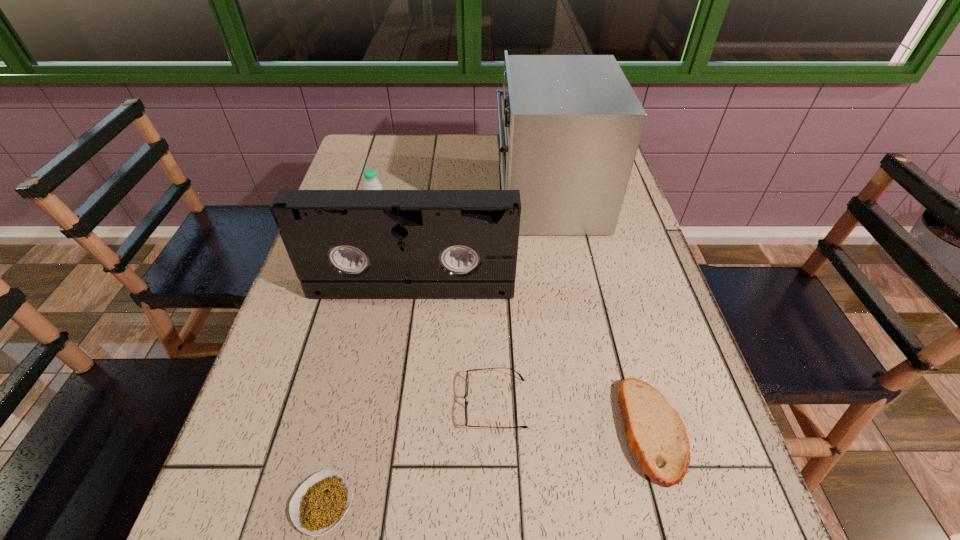
Find the location of `vacant region located 0.340m on the side of the fourth nearest object with visible spindles`. vacant region located 0.340m on the side of the fourth nearest object with visible spindles is located at coordinates (390, 443).

Identify the location of vacant region located on the right of the water bottle. (480, 223).

Identify the location of vacant space located 0.070m on the front of the pita bread. This screenshot has height=540, width=960. (683, 535).

You are a GUI agent. You are given a task and a screenshot of the screen. Output one action in this format:
    pyautogui.click(x=<x>, y=<y>)
    Task: Click on the free spot located 0.100m on the front-facing side of the second shortest object
    The image size is (960, 540).
    Given the screenshot: What is the action you would take?
    pyautogui.click(x=412, y=403)

Identify the location of free location located 0.330m on the front-facing side of the second shortest object. This screenshot has width=960, height=540. (291, 403).

Identify the location of blank space located 0.130m on the front-facing side of the second shortest object. This screenshot has height=540, width=960. (396, 403).

Identify the location of free region located on the back of the legume. The image size is (960, 540). (367, 313).

This screenshot has width=960, height=540. I want to click on object that is positioned at the far edge, so click(x=570, y=125).

You are a GUI agent. You are given a task and a screenshot of the screen. Output one action in this format:
    pyautogui.click(x=<x>, y=<y>)
    Task: Click on the object that is positioned at the near edge
    This screenshot has width=960, height=540.
    Given the screenshot: What is the action you would take?
    pyautogui.click(x=321, y=502)

Locate an element on the screen. The height and width of the screenshot is (540, 960). videotape at the left edge is located at coordinates (343, 244).